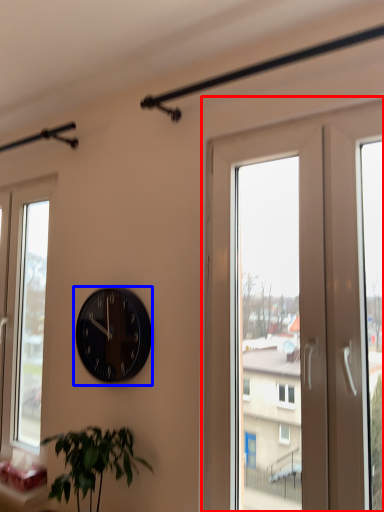
Question: Which object is closer to the camera taking this photo, screen door (highlighted by a red box) or wall clock (highlighted by a blue box)?

Choices:
 (A) screen door
 (B) wall clock

Answer: (A)